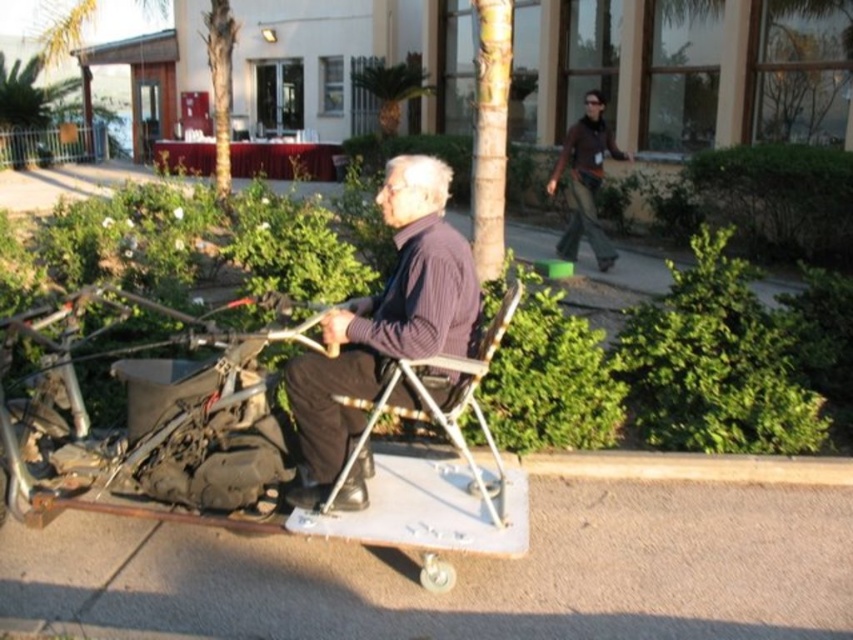
You are standing at the edge of the gray concrete pavement at lower center and want to look at the green textured palm tree at upper left. Which object will appear larger to you?

The green textured palm tree at upper left will appear larger because it is larger than the gray concrete pavement at lower center.